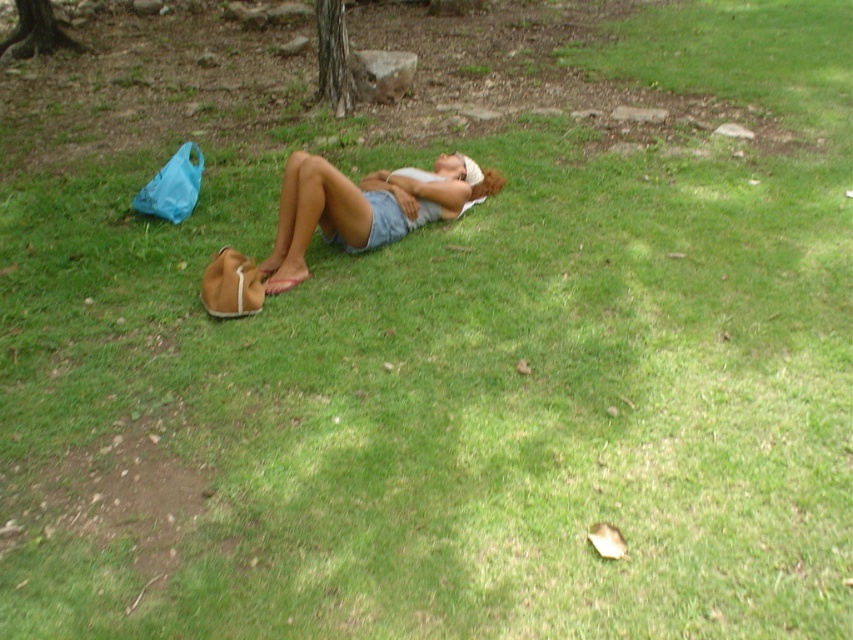
Is point (432, 180) positioned behind point (36, 51)?

No, it is not.

Does denim shorts at center have a greater height compared to brown textured tree trunk at upper left?

Incorrect, denim shorts at center's height is not larger of brown textured tree trunk at upper left's.

Between point (303, 262) and point (39, 45), which one is positioned in front?

Positioned in front is point (303, 262).

Locate an element on the screen. denim shorts at center is located at coordinates (364, 208).

Between denim shorts at center and brown textured tree trunk at upper center, which one has more height?

Standing taller between the two is brown textured tree trunk at upper center.

Describe the element at coordinates (364, 208) in the screenshot. This screenshot has width=853, height=640. I see `denim shorts at center` at that location.

The width and height of the screenshot is (853, 640). I want to click on denim shorts at center, so click(x=364, y=208).

Is brown textured tree trunk at upper center to the right of brown textured tree trunk at upper left from the viewer's perspective?

Correct, you'll find brown textured tree trunk at upper center to the right of brown textured tree trunk at upper left.

Does brown textured tree trunk at upper center have a lesser height compared to brown textured tree trunk at upper left?

No.

Measure the distance between brown textured tree trunk at upper center and camera.

brown textured tree trunk at upper center is 21.32 feet away from camera.

Find the location of a particular element. This screenshot has height=640, width=853. brown textured tree trunk at upper center is located at coordinates (334, 58).